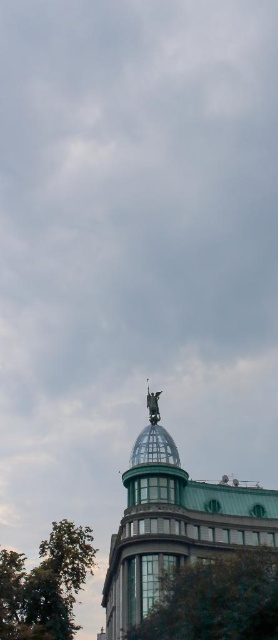
Who is more forward, (125, 595) or (55, 621)?

Positioned in front is point (125, 595).

Which of these two, polished bronze statue at center or green leafy tree at lower left, stands taller?

With more height is polished bronze statue at center.

The image size is (278, 640). In order to click on polished bronze statue at center in this screenshot , I will do `click(174, 525)`.

Does polished bronze statue at center have a smaller size compared to green leafy tree at lower center?

No.

Image resolution: width=278 pixels, height=640 pixels. In order to click on polished bronze statue at center in this screenshot , I will do 174,525.

Identify the location of polished bronze statue at center. Image resolution: width=278 pixels, height=640 pixels. (174, 525).

Is polished bronze statue at center below polished bronze statue at top?

Yes, polished bronze statue at center is below polished bronze statue at top.

Is polished bronze statue at center positioned behind polished bronze statue at top?

No, it is in front of polished bronze statue at top.

Who is more forward, (x=209, y=540) or (x=152, y=408)?

Point (x=209, y=540) is in front.

What are the coordinates of `polished bronze statue at center` in the screenshot? It's located at (174, 525).